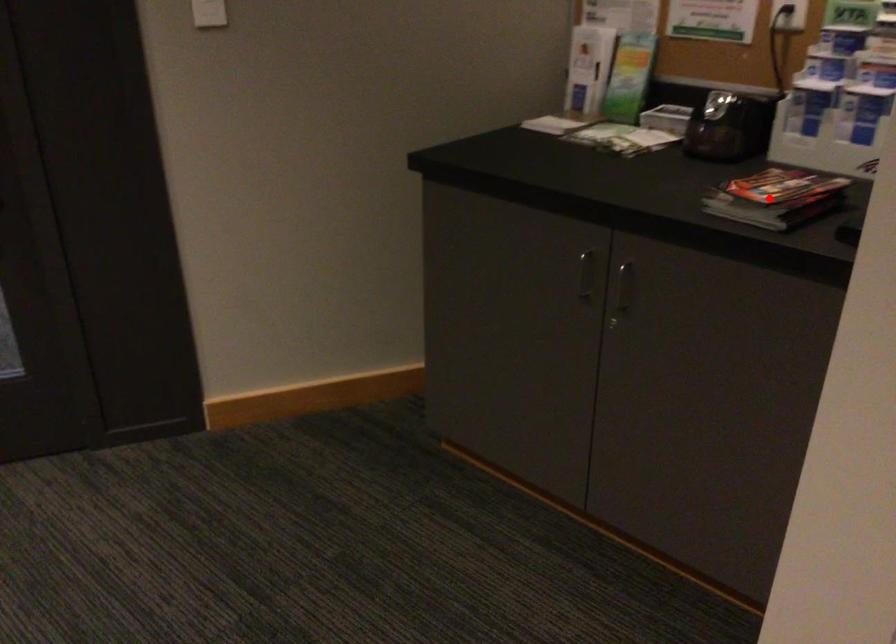
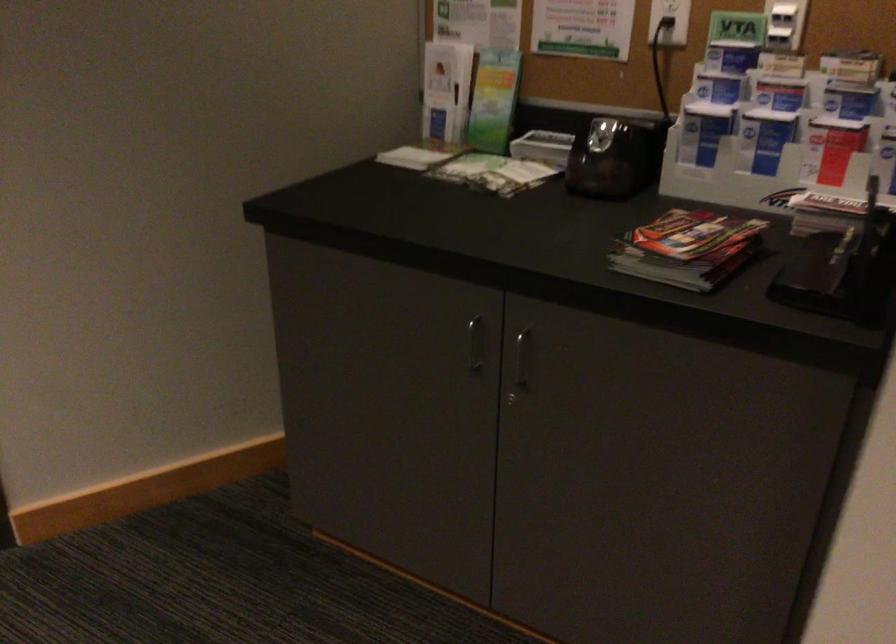
Find the pixel in the second image that matches the highlighted location in the first image.

(687, 249)